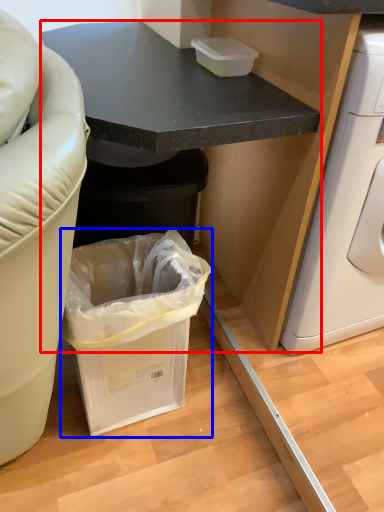
Question: Which point is closer to the camera, cabinetry (highlighted by a red box) or trash bin/can (highlighted by a blue box)?

Choices:
 (A) cabinetry
 (B) trash bin/can

Answer: (A)